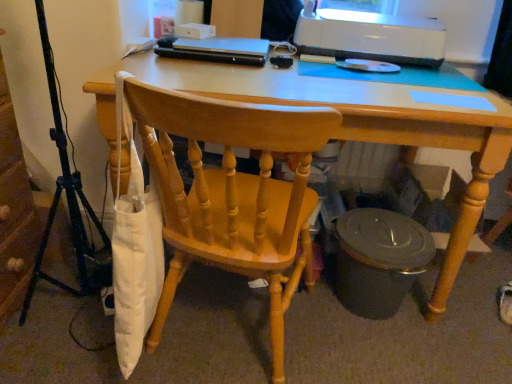
Question: Can you confirm if metallic tripod at left is taller than matte black trash can at lower right?

Choices:
 (A) yes
 (B) no

Answer: (A)

Question: Would you say matte black trash can at lower right is part of metallic tripod at left's contents?

Choices:
 (A) no
 (B) yes

Answer: (A)

Question: Can you confirm if metallic tripod at left is wider than matte black trash can at lower right?

Choices:
 (A) yes
 (B) no

Answer: (B)

Question: From a real-world perspective, is metallic tripod at left located higher than matte black trash can at lower right?

Choices:
 (A) no
 (B) yes

Answer: (B)

Question: Is metallic tripod at left at the right side of matte black trash can at lower right?

Choices:
 (A) no
 (B) yes

Answer: (A)

Question: From the image's perspective, is light wood desk at center positioned above or below matte black trash can at lower right?

Choices:
 (A) below
 (B) above

Answer: (B)

Question: Is light wood desk at center taller or shorter than matte black trash can at lower right?

Choices:
 (A) tall
 (B) short

Answer: (A)

Question: Is point (104, 117) positioned closer to the camera than point (375, 220)?

Choices:
 (A) farther
 (B) closer

Answer: (B)

Question: In terms of size, does light wood desk at center appear bigger or smaller than matte black trash can at lower right?

Choices:
 (A) big
 (B) small

Answer: (A)

Question: Considering their positions, is matte black trash can at lower right located in front of or behind light wood desk at center?

Choices:
 (A) behind
 (B) front

Answer: (A)

Question: Visually, is matte black trash can at lower right positioned to the left or to the right of light wood desk at center?

Choices:
 (A) left
 (B) right

Answer: (B)

Question: From a real-world perspective, is matte black trash can at lower right above or below light wood desk at center?

Choices:
 (A) above
 (B) below

Answer: (B)

Question: Is matte black trash can at lower right inside or outside of light wood desk at center?

Choices:
 (A) inside
 (B) outside

Answer: (A)

Question: From the image's perspective, relative to wooden chair at center, is matte black trash can at lower right above or below?

Choices:
 (A) below
 (B) above

Answer: (A)

Question: Considering the positions of matte black trash can at lower right and wooden chair at center in the image, is matte black trash can at lower right bigger or smaller than wooden chair at center?

Choices:
 (A) big
 (B) small

Answer: (B)